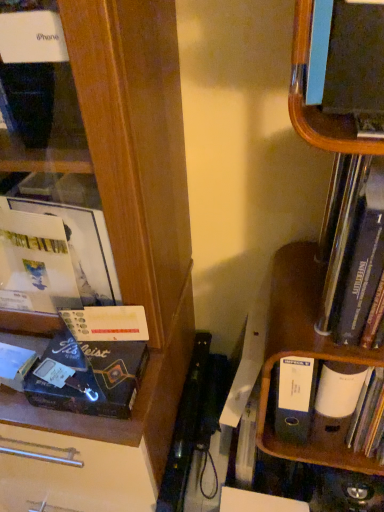
Question: Is black cardboard book at left positioned behind blue cardboard file at lower right?

Choices:
 (A) yes
 (B) no

Answer: (B)

Question: Is black cardboard book at left oriented away from blue cardboard file at lower right?

Choices:
 (A) yes
 (B) no

Answer: (B)

Question: Is black cardboard book at left thinner than blue cardboard file at lower right?

Choices:
 (A) no
 (B) yes

Answer: (B)

Question: Could you tell me if black cardboard book at left is facing blue cardboard file at lower right?

Choices:
 (A) yes
 (B) no

Answer: (B)

Question: Considering the relative sizes of black cardboard book at left and blue cardboard file at lower right in the image provided, is black cardboard book at left bigger than blue cardboard file at lower right?

Choices:
 (A) yes
 (B) no

Answer: (B)

Question: Considering the relative sizes of black cardboard book at left and blue cardboard file at lower right in the image provided, is black cardboard book at left shorter than blue cardboard file at lower right?

Choices:
 (A) no
 (B) yes

Answer: (B)

Question: From a real-world perspective, does wooden bookshelf at right, the 1th shelf when ordered from bottom to top, sit lower than blue cardboard file at lower right?

Choices:
 (A) no
 (B) yes

Answer: (A)

Question: From a real-world perspective, is wooden bookshelf at right, the 1th shelf when ordered from bottom to top, on top of blue cardboard file at lower right?

Choices:
 (A) no
 (B) yes

Answer: (B)

Question: Is blue cardboard file at lower right a part of wooden bookshelf at right, acting as the second shelf starting from the top?

Choices:
 (A) no
 (B) yes

Answer: (B)

Question: Considering the relative sizes of wooden bookshelf at right, the 1th shelf when ordered from bottom to top, and blue cardboard file at lower right in the image provided, is wooden bookshelf at right, the 1th shelf when ordered from bottom to top, wider than blue cardboard file at lower right?

Choices:
 (A) yes
 (B) no

Answer: (A)

Question: Is wooden bookshelf at right, the 1th shelf when ordered from bottom to top, not close to blue cardboard file at lower right?

Choices:
 (A) yes
 (B) no

Answer: (B)

Question: Considering the relative sizes of wooden bookshelf at right, the 1th shelf when ordered from bottom to top, and blue cardboard file at lower right in the image provided, is wooden bookshelf at right, the 1th shelf when ordered from bottom to top, smaller than blue cardboard file at lower right?

Choices:
 (A) no
 (B) yes

Answer: (A)

Question: Is matte black bookshelf at upper right, which is counted as the 1th shelf, starting from the top, taller than black cardboard book at left?

Choices:
 (A) no
 (B) yes

Answer: (B)